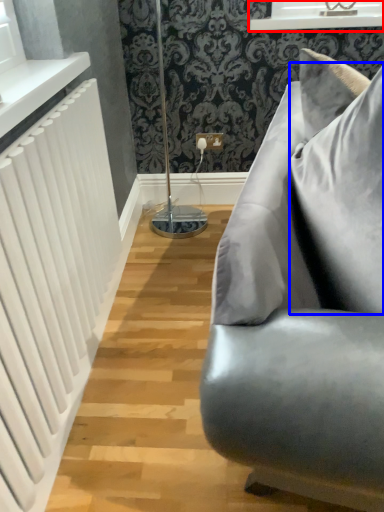
Question: Which object appears closest to the camera in this image, window frame (highlighted by a red box) or pillow (highlighted by a blue box)?

Choices:
 (A) window frame
 (B) pillow

Answer: (B)